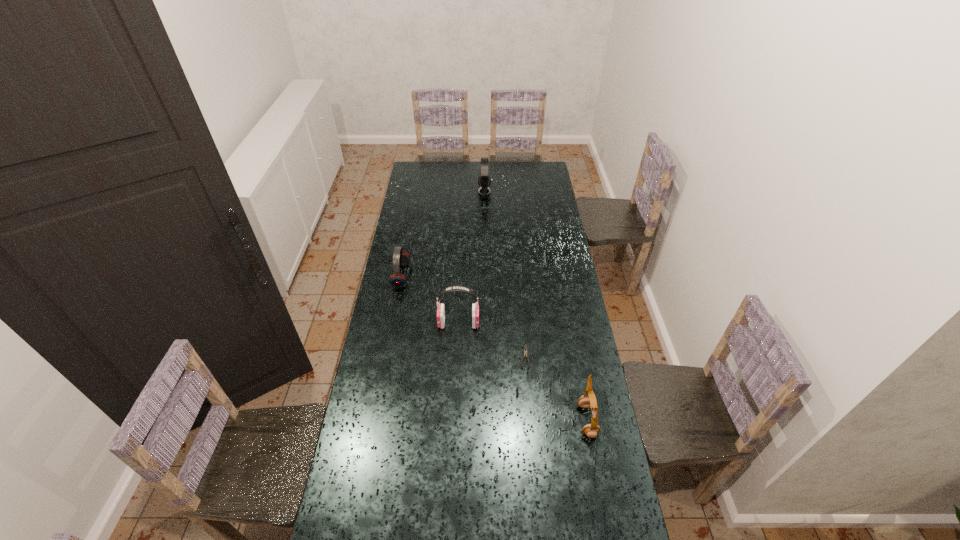
You are a GUI agent. You are given a task and a screenshot of the screen. Output one action in this format:
    pyautogui.click(x=<x>, y=<y>)
    Task: Click on the third farthest object
    
    Given the screenshot: What is the action you would take?
    pyautogui.click(x=453, y=288)

At what (x,y) coordinates should I click in order to perform the action: click on the farthest earphone. Please return your answer as a coordinate pair (x, y). The width and height of the screenshot is (960, 540). Looking at the image, I should click on (484, 180).

I want to click on the rightmost object, so [x=588, y=399].

Where is `the nearest object`? the nearest object is located at coordinates pos(588,399).

Find the location of a particular element. Image resolution: width=960 pixels, height=540 pixels. the third nearest earphone is located at coordinates click(x=397, y=280).

This screenshot has width=960, height=540. I want to click on the shortest earphone, so click(x=397, y=280).

Identify the location of the shortest object. The width and height of the screenshot is (960, 540). (525, 348).

What are the coordinates of `the second nearest object` in the screenshot? It's located at (525, 348).

Find the location of a particular element. Image resolution: width=960 pixels, height=540 pixels. vacant space situated on the outer surface of the second nearest earphone is located at coordinates (562, 323).

Find the location of `free space located 0.200m on the ear cups of the farthest earphone`. free space located 0.200m on the ear cups of the farthest earphone is located at coordinates (444, 191).